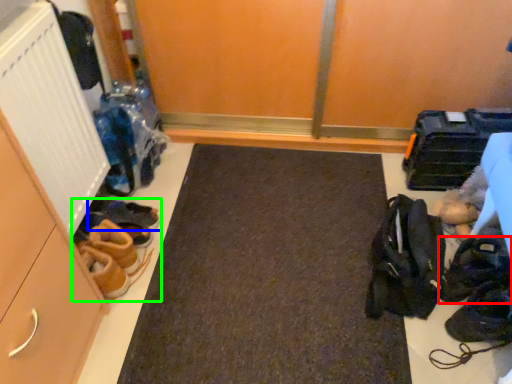
Question: Considering the real-world distances, which object is farthest from footwear (highlighted by a red box)? footwear (highlighted by a blue box) or footwear (highlighted by a green box)?

Choices:
 (A) footwear
 (B) footwear

Answer: (A)